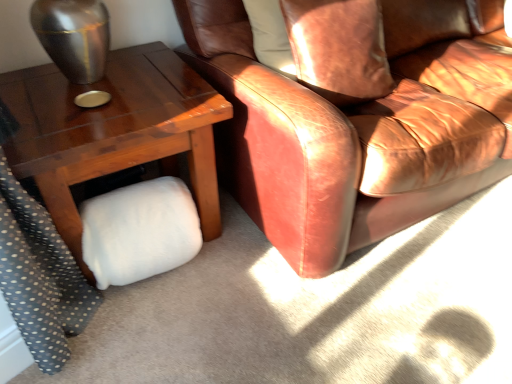
This screenshot has height=384, width=512. In order to click on empty space that is ontop of wooden table at lower left in this screenshot , I will do `click(103, 90)`.